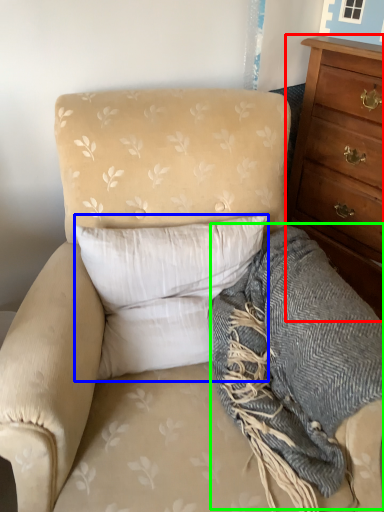
Question: Which object is the farthest from chest of drawers (highlighted by a red box)? Choose among these: pillow (highlighted by a blue box) or blanket (highlighted by a green box).

Choices:
 (A) pillow
 (B) blanket

Answer: (A)